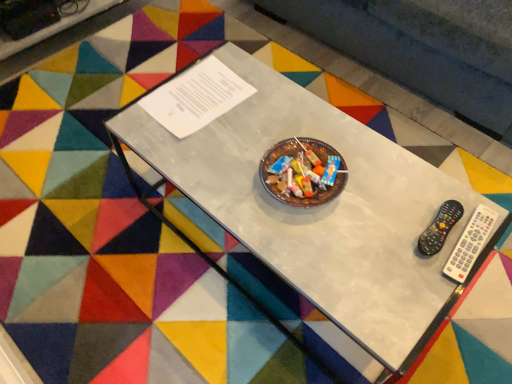
Question: Is white plastic remote at right facing towards metallic glass table at center?

Choices:
 (A) yes
 (B) no

Answer: (A)

Question: Does white plastic remote at right come in front of metallic glass table at center?

Choices:
 (A) no
 (B) yes

Answer: (A)

Question: Is white plastic remote at right bigger than metallic glass table at center?

Choices:
 (A) yes
 (B) no

Answer: (B)

Question: Is white plastic remote at right shorter than metallic glass table at center?

Choices:
 (A) no
 (B) yes

Answer: (B)

Question: Is white plastic remote at right at the left side of metallic glass table at center?

Choices:
 (A) yes
 (B) no

Answer: (B)

Question: Is metallic glass table at center surrounded by white plastic remote at right?

Choices:
 (A) no
 (B) yes

Answer: (A)

Question: Is black plastic remote at right aimed at white plastic remote at right?

Choices:
 (A) no
 (B) yes

Answer: (A)

Question: Can you confirm if black plastic remote at right is smaller than white plastic remote at right?

Choices:
 (A) no
 (B) yes

Answer: (A)

Question: Is black plastic remote at right taller than white plastic remote at right?

Choices:
 (A) yes
 (B) no

Answer: (A)

Question: From the image's perspective, is black plastic remote at right below white plastic remote at right?

Choices:
 (A) no
 (B) yes

Answer: (A)

Question: Considering the relative sizes of black plastic remote at right and white plastic remote at right in the image provided, is black plastic remote at right wider than white plastic remote at right?

Choices:
 (A) yes
 (B) no

Answer: (B)

Question: Is black plastic remote at right closer to camera compared to white plastic remote at right?

Choices:
 (A) no
 (B) yes

Answer: (A)

Question: From a real-world perspective, is metallic glass table at center on top of white plastic remote at right?

Choices:
 (A) no
 (B) yes

Answer: (A)